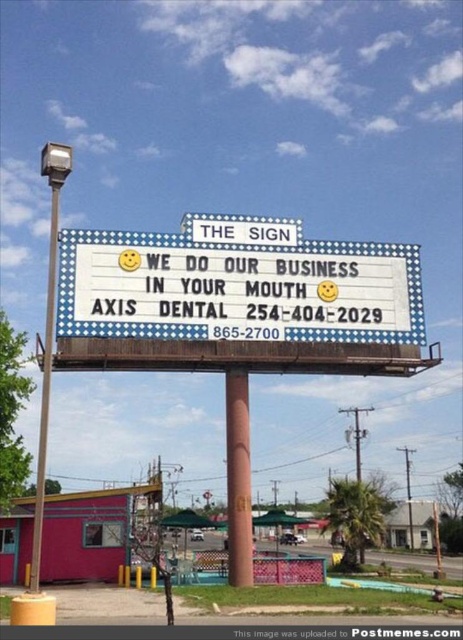
Can you confirm if white plastic marquee board at center is positioned to the left of metallic pole at left?

Incorrect, white plastic marquee board at center is not on the left side of metallic pole at left.

Is point (91, 230) behind point (55, 228)?

That is False.

Identify the location of white plastic marquee board at center. The width and height of the screenshot is (463, 640). (237, 289).

Is brown painted wood pole at center smaller than metallic pole at left?

Yes, brown painted wood pole at center is smaller than metallic pole at left.

Can you confirm if brown painted wood pole at center is bigger than metallic pole at left?

Incorrect, brown painted wood pole at center is not larger than metallic pole at left.

Identify the location of brown painted wood pole at center. (237, 477).

Does white plastic marquee board at center have a greater width compared to brown painted wood pole at center?

Correct, the width of white plastic marquee board at center exceeds that of brown painted wood pole at center.

Does point (254, 301) lie in front of point (237, 497)?

No, (254, 301) is behind (237, 497).

In order to click on white plastic marquee board at center in this screenshot , I will do `click(237, 289)`.